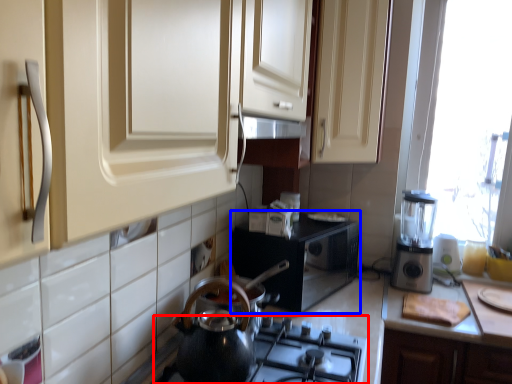
Question: Which of the following is the farthest to the observer, gas stove (highlighted by a red box) or appliance (highlighted by a blue box)?

Choices:
 (A) gas stove
 (B) appliance

Answer: (B)